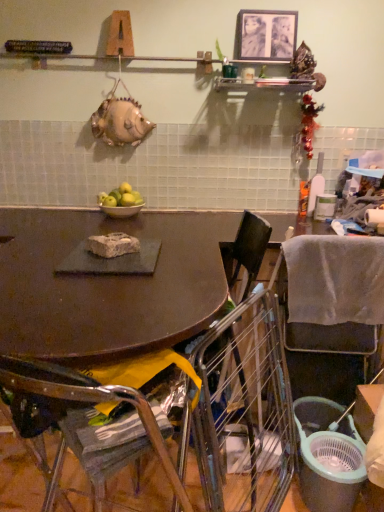
Question: Is green matte apples at center further to camera compared to matte black table at center?

Choices:
 (A) no
 (B) yes

Answer: (B)

Question: From the image's perspective, is green matte apples at center beneath matte black table at center?

Choices:
 (A) no
 (B) yes

Answer: (A)

Question: Is green matte apples at center not within matte black table at center?

Choices:
 (A) yes
 (B) no

Answer: (A)

Question: Does green matte apples at center have a lesser width compared to matte black table at center?

Choices:
 (A) yes
 (B) no

Answer: (A)

Question: Could you tell me if green matte apples at center is facing matte black table at center?

Choices:
 (A) no
 (B) yes

Answer: (A)

Question: Based on their sizes in the image, would you say metallic silver shelf at upper center is bigger or smaller than metallic silver picture frame at upper center?

Choices:
 (A) small
 (B) big

Answer: (B)

Question: Looking at their shapes, would you say metallic silver shelf at upper center is wider or thinner than metallic silver picture frame at upper center?

Choices:
 (A) wide
 (B) thin

Answer: (A)

Question: Does point (304, 77) appear closer or farther from the camera than point (276, 51)?

Choices:
 (A) farther
 (B) closer

Answer: (B)

Question: In the image, is metallic silver shelf at upper center on the left side or the right side of metallic silver picture frame at upper center?

Choices:
 (A) right
 (B) left

Answer: (B)

Question: Based on their positions, is metallic silver picture frame at upper center located to the left or right of metallic silver shelf at upper center?

Choices:
 (A) left
 (B) right

Answer: (B)

Question: Is point (240, 33) positioned closer to the camera than point (286, 89)?

Choices:
 (A) farther
 (B) closer

Answer: (B)

Question: From the image's perspective, is metallic silver picture frame at upper center positioned above or below metallic silver shelf at upper center?

Choices:
 (A) above
 (B) below

Answer: (A)

Question: Do you think metallic silver picture frame at upper center is within metallic silver shelf at upper center, or outside of it?

Choices:
 (A) outside
 (B) inside

Answer: (A)

Question: From the image's perspective, is green matte apples at center located above or below metallic silver shelf at upper center?

Choices:
 (A) below
 (B) above

Answer: (A)

Question: From a real-world perspective, is green matte apples at center above or below metallic silver shelf at upper center?

Choices:
 (A) above
 (B) below

Answer: (B)